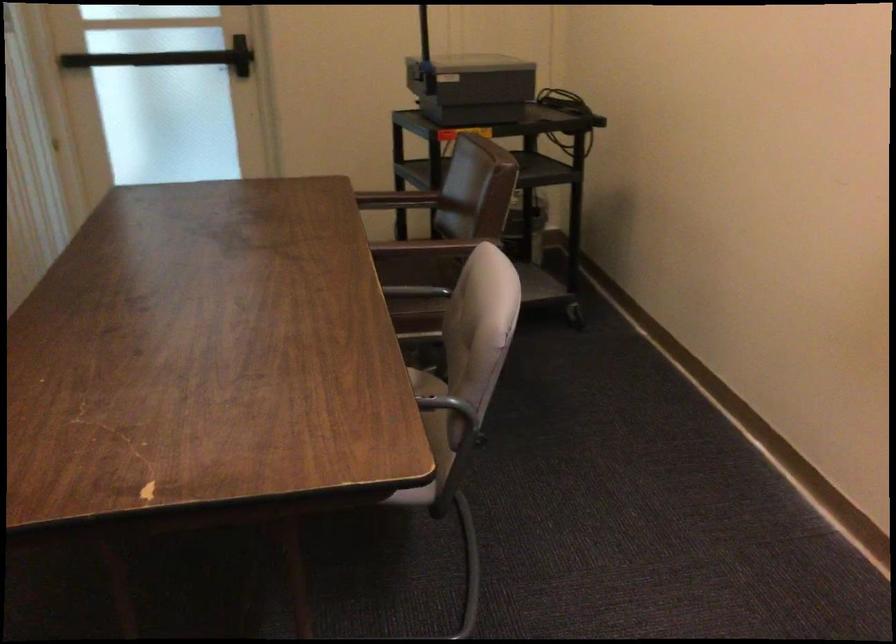
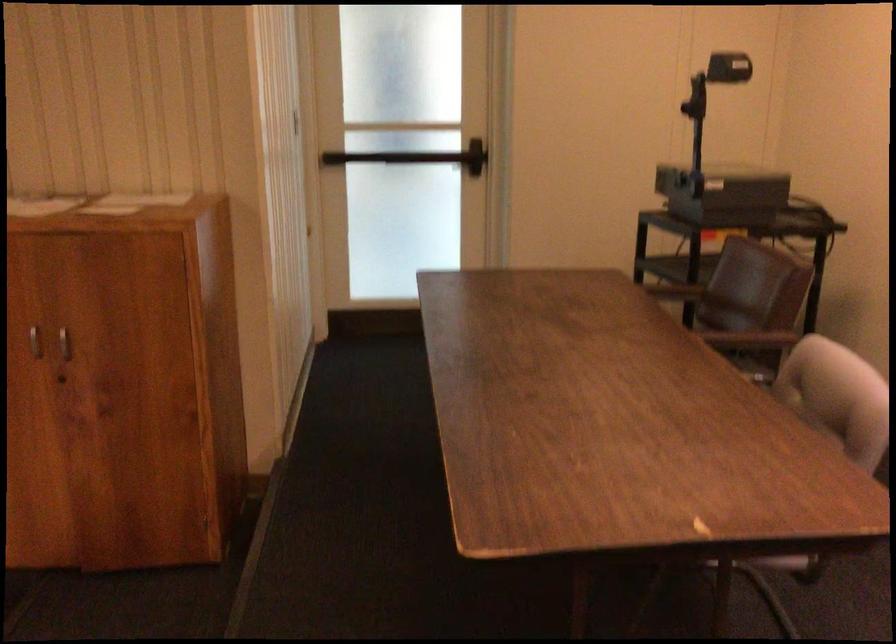
Question: The images are taken continuously from a first-person perspective. In which direction is your viewpoint rotating?

Choices:
 (A) Left
 (B) Right
 (C) Up
 (D) Down

Answer: (C)